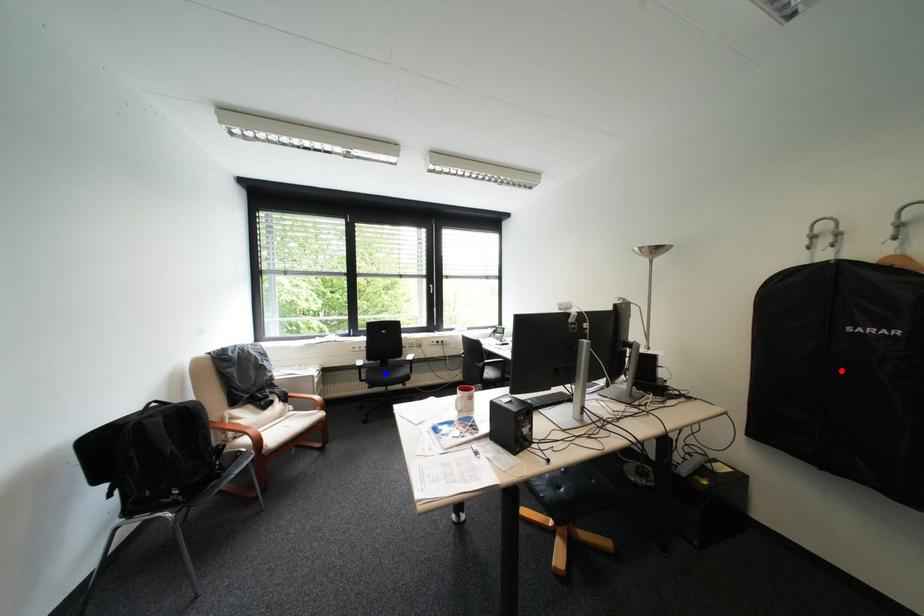
Question: Two points are marked on the image. Which point is closer to the camera?

Choices:
 (A) Blue point is closer.
 (B) Red point is closer.

Answer: (B)